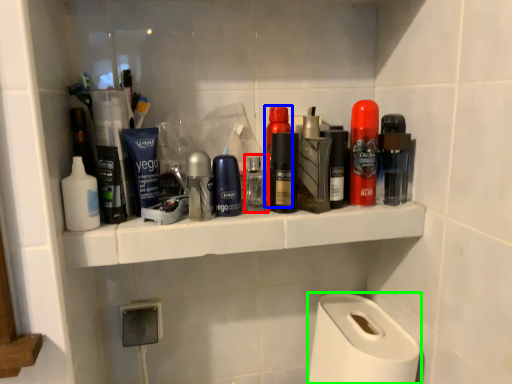
Question: Considering the real-world distances, which object is farthest from toiletry (highlighted by a red box)? personal care (highlighted by a blue box) or paper towel (highlighted by a green box)?

Choices:
 (A) personal care
 (B) paper towel

Answer: (B)